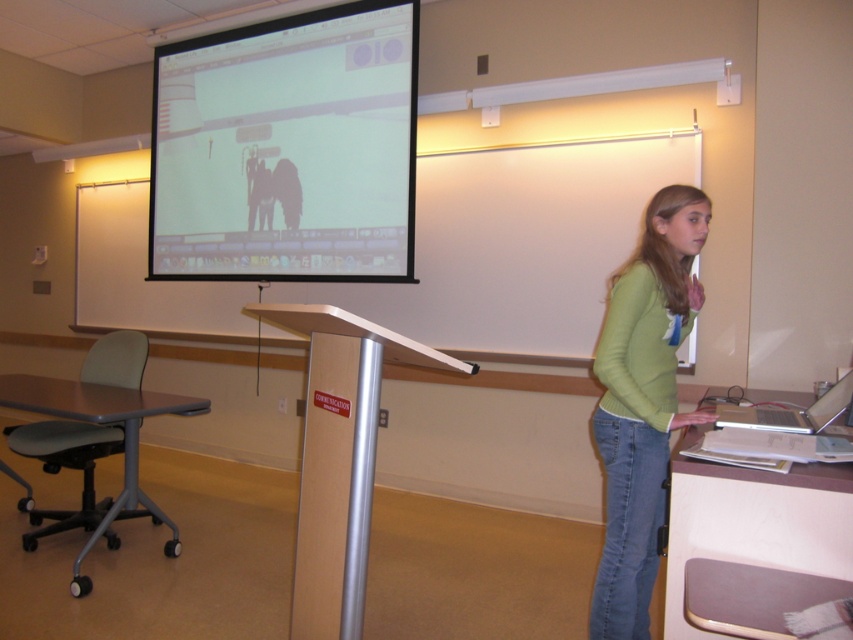
You are a student sitting at the light brown wooden table at lower right and want to look at the white matte projection screen at upper center. Which direction should you turn your head to see it?

The white matte projection screen at upper center is positioned on the left side of the light brown wooden table at lower right, so you should turn your head to the left to see it.